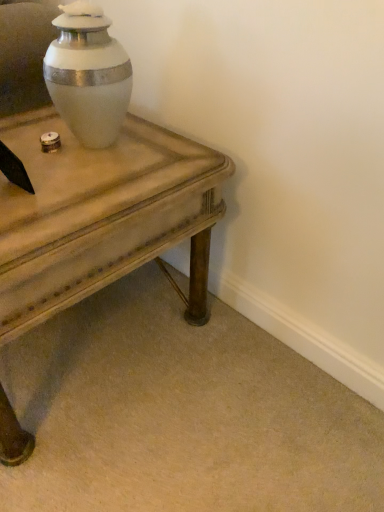
The width and height of the screenshot is (384, 512). Describe the element at coordinates (88, 75) in the screenshot. I see `white glossy urn at upper center` at that location.

In order to face white glossy urn at upper center, should I rotate leftwards or rightwards?

Rotate your view left by about 13.829°.

Locate an element on the screen. white glossy urn at upper center is located at coordinates (88, 75).

The width and height of the screenshot is (384, 512). Describe the element at coordinates (95, 212) in the screenshot. I see `wooden side table at center` at that location.

This screenshot has height=512, width=384. I want to click on wooden side table at center, so click(x=95, y=212).

Locate an element on the screen. white glossy urn at upper center is located at coordinates (88, 75).

Considering the relative positions of white glossy urn at upper center and wooden side table at center in the image provided, is white glossy urn at upper center to the right of wooden side table at center from the viewer's perspective?

Indeed, white glossy urn at upper center is positioned on the right side of wooden side table at center.

Between white glossy urn at upper center and wooden side table at center, which one is positioned in front?

Positioned in front is wooden side table at center.

Which point is more forward, (57, 95) or (120, 187)?

Point (120, 187)

From the image's perspective, does white glossy urn at upper center appear lower than wooden side table at center?

No, from the image's perspective, white glossy urn at upper center is not below wooden side table at center.

From a real-world perspective, is white glossy urn at upper center on wooden side table at center?

Yes.

Considering the relative sizes of white glossy urn at upper center and wooden side table at center in the image provided, is white glossy urn at upper center thinner than wooden side table at center?

Yes.

Considering the relative sizes of white glossy urn at upper center and wooden side table at center in the image provided, is white glossy urn at upper center shorter than wooden side table at center?

Correct, white glossy urn at upper center is not as tall as wooden side table at center.

Consider the image. Is white glossy urn at upper center bigger or smaller than wooden side table at center?

Considering their sizes, white glossy urn at upper center takes up less space than wooden side table at center.

Is white glossy urn at upper center surrounding wooden side table at center?

That's incorrect, wooden side table at center is not inside white glossy urn at upper center.

Is white glossy urn at upper center far from wooden side table at center?

Actually, white glossy urn at upper center and wooden side table at center are a little close together.

Could you tell me if white glossy urn at upper center is turned towards wooden side table at center?

No, white glossy urn at upper center is not aimed at wooden side table at center.

Can you tell me how much white glossy urn at upper center and wooden side table at center differ in facing direction?

The facing directions of white glossy urn at upper center and wooden side table at center are 23.1 degrees apart.

Measure the distance from white glossy urn at upper center to wooden side table at center.

white glossy urn at upper center and wooden side table at center are 7.34 inches apart.

Identify the location of table beneath the white glossy urn at upper center (from a real-world perspective). The image size is (384, 512). (95, 212).

Which is more to the left, wooden side table at center or white glossy urn at upper center?

Positioned to the left is wooden side table at center.

Which object is more forward, wooden side table at center or white glossy urn at upper center?

wooden side table at center is closer to the camera.

Is point (128, 181) positioned in front of point (92, 23)?

No, it is not.

From the image's perspective, does wooden side table at center appear lower than white glossy urn at upper center?

Yes, from the image's perspective, wooden side table at center is beneath white glossy urn at upper center.

From a real-world perspective, which object stands above the other?

From a 3D spatial view, white glossy urn at upper center is above.

Between wooden side table at center and white glossy urn at upper center, which one has larger width?

wooden side table at center is wider.

From the picture: Considering the relative sizes of wooden side table at center and white glossy urn at upper center in the image provided, is wooden side table at center shorter than white glossy urn at upper center?

No, wooden side table at center is not shorter than white glossy urn at upper center.

Consider the image. Considering the relative sizes of wooden side table at center and white glossy urn at upper center in the image provided, is wooden side table at center bigger than white glossy urn at upper center?

Indeed, wooden side table at center has a larger size compared to white glossy urn at upper center.

Is white glossy urn at upper center surrounded by wooden side table at center?

Actually, white glossy urn at upper center is outside wooden side table at center.

Is wooden side table at center not close to white glossy urn at upper center?

No, wooden side table at center is not far away from white glossy urn at upper center.

Is wooden side table at center facing away from white glossy urn at upper center?

wooden side table at center does not have its back to white glossy urn at upper center.

Where is `table below the white glossy urn at upper center (from the image's perspective)`? table below the white glossy urn at upper center (from the image's perspective) is located at coordinates (95, 212).

Locate an element on the screen. The width and height of the screenshot is (384, 512). table below the white glossy urn at upper center (from a real-world perspective) is located at coordinates (95, 212).

Locate an element on the screen. The width and height of the screenshot is (384, 512). table located below the white glossy urn at upper center (from the image's perspective) is located at coordinates (95, 212).